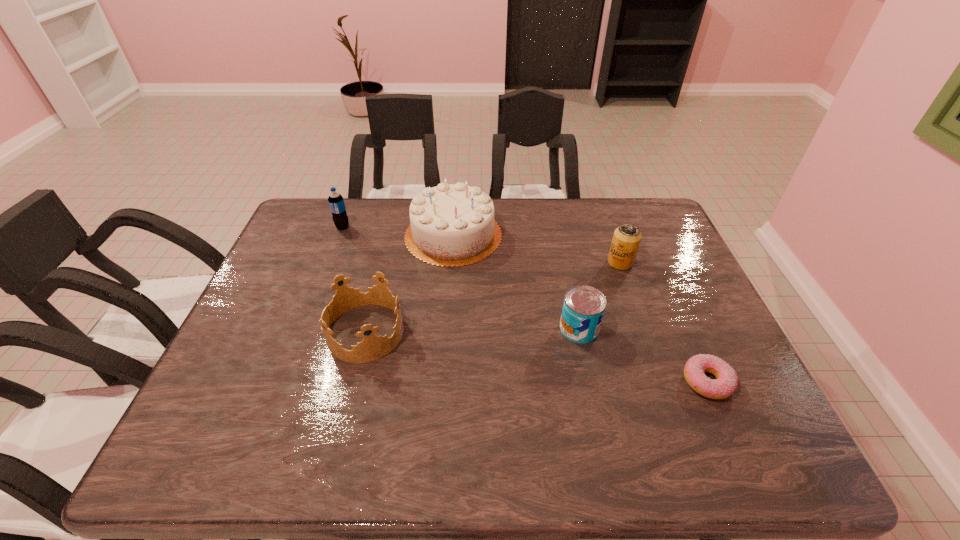
Where is `free spot between the birthday cake and the second object from right to left`? The width and height of the screenshot is (960, 540). free spot between the birthday cake and the second object from right to left is located at coordinates (537, 249).

At what (x,y) coordinates should I click in order to perform the action: click on unoccupied area between the leftmost object and the third object from right to left. Please return your answer as a coordinate pair (x, y). The height and width of the screenshot is (540, 960). Looking at the image, I should click on (461, 278).

At what (x,y) coordinates should I click in order to perform the action: click on free point between the tiara and the birthday cake. Please return your answer as a coordinate pair (x, y). The image size is (960, 540). Looking at the image, I should click on (409, 284).

The image size is (960, 540). Identify the location of vacant area between the doughnut and the leftmost object. (525, 305).

Locate an element on the screen. object that ranks as the fifth closest to the leftmost object is located at coordinates (726, 382).

At what (x,y) coordinates should I click in order to perform the action: click on object that is the second closest to the birthday cake. Please return your answer as a coordinate pair (x, y). The width and height of the screenshot is (960, 540). Looking at the image, I should click on point(336,202).

What are the coordinates of `free space that satisfies the following two spatial constraints: 1. on the front side of the second shortest object; 2. on the front-facing side of the tiara` in the screenshot? It's located at (580, 332).

This screenshot has height=540, width=960. I want to click on free space that satisfies the following two spatial constraints: 1. on the back side of the beer can; 2. on the right side of the fifth tallest object, so click(x=565, y=262).

Where is `vacant space that satisfies the following two spatial constraints: 1. on the front-facing side of the tiara; 2. on the back side of the shortest object`? vacant space that satisfies the following two spatial constraints: 1. on the front-facing side of the tiara; 2. on the back side of the shortest object is located at coordinates (352, 382).